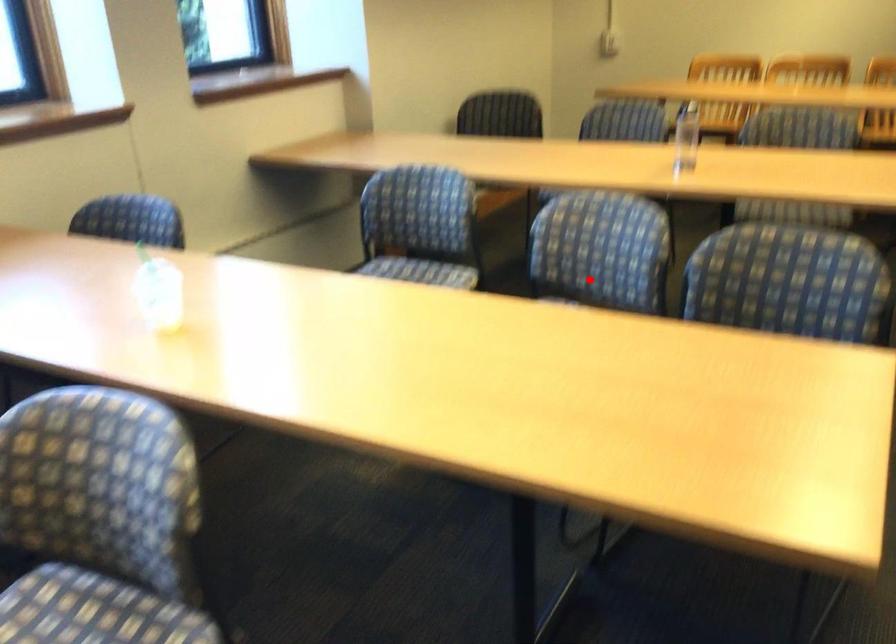
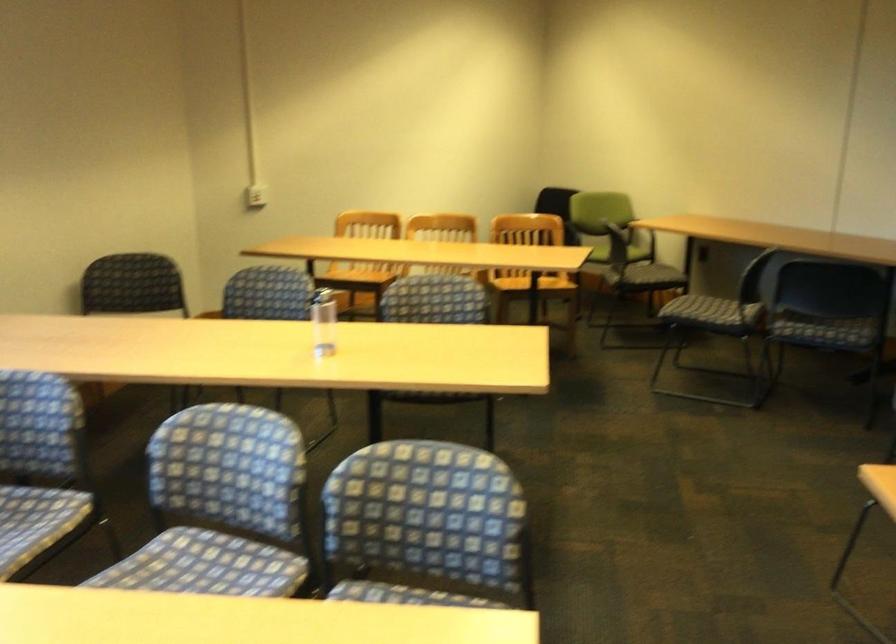
Question: I am providing you with two images of the same scene from different viewpoints. Image1 has a red point marked. In image2, the corresponding 3D location appears at what relative position? Reply with the corresponding letter.

Choices:
 (A) Closer
 (B) Farther

Answer: (A)